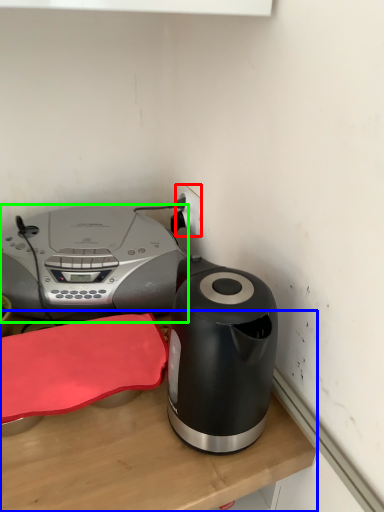
Question: Estimate the real-world distances between objects in this image. Which object is closer to electric outlet (highlighted by a red box), table (highlighted by a blue box) or home appliance (highlighted by a green box)?

Choices:
 (A) table
 (B) home appliance

Answer: (B)